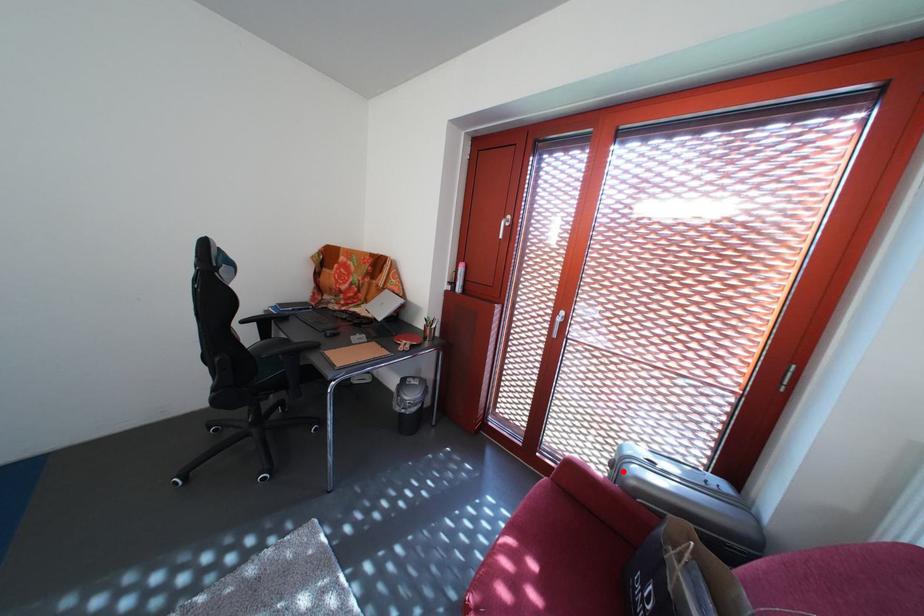
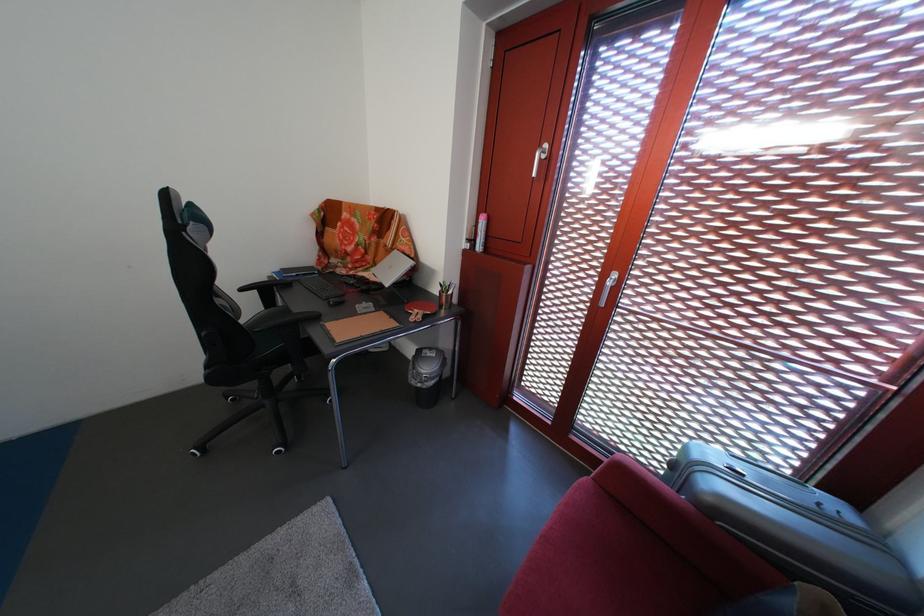
Where in the second image is the point corresponding to the highlighted location from the first image?

(684, 472)